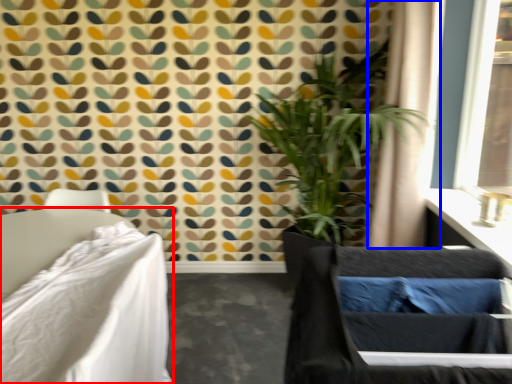
Question: Which of the following is the farthest to the observer, furniture (highlighted by a red box) or curtain (highlighted by a blue box)?

Choices:
 (A) furniture
 (B) curtain

Answer: (B)